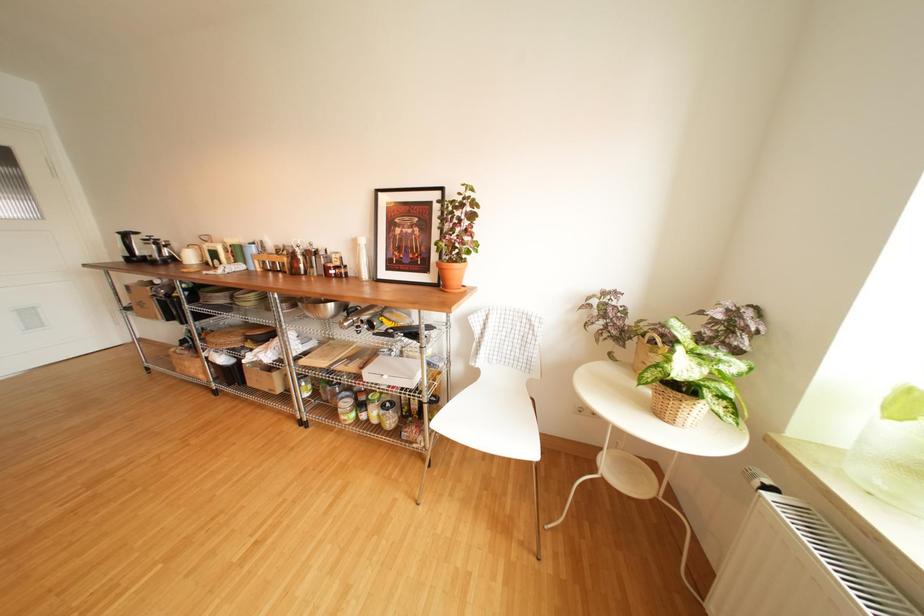
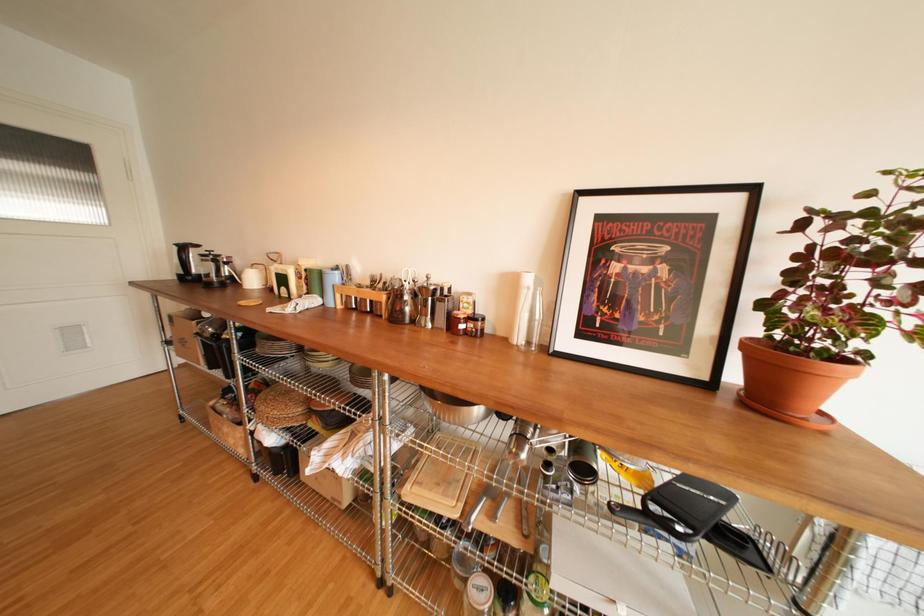
What movement of the cameraman would produce the second image?

The movement direction of the cameraman is left, forward.